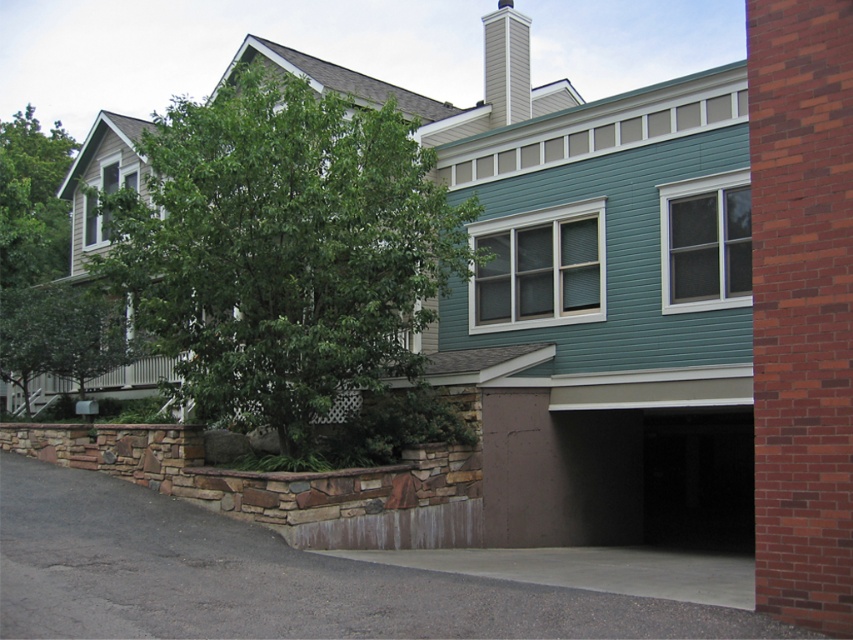
Does gray concrete driveway at lower left have a larger size compared to white painted wood chimney at upper center?

Actually, gray concrete driveway at lower left might be smaller than white painted wood chimney at upper center.

Find the location of a particular element. The image size is (853, 640). gray concrete driveway at lower left is located at coordinates (267, 579).

Measure the distance between gray concrete driveway at lower left and green leafy tree at upper left.

They are 28.35 meters apart.

Between point (54, 605) and point (33, 145), which one is positioned in front?

Point (54, 605)

I want to click on gray concrete driveway at lower left, so click(267, 579).

Can you confirm if green leafy tree at center is positioned to the right of gray concrete driveway at lower left?

Incorrect, green leafy tree at center is not on the right side of gray concrete driveway at lower left.

Does green leafy tree at center have a greater height compared to gray concrete driveway at lower left?

Yes, green leafy tree at center is taller than gray concrete driveway at lower left.

Is point (461, 208) positioned before point (45, 500)?

No, (461, 208) is behind (45, 500).

This screenshot has height=640, width=853. In order to click on green leafy tree at center in this screenshot , I will do `click(283, 248)`.